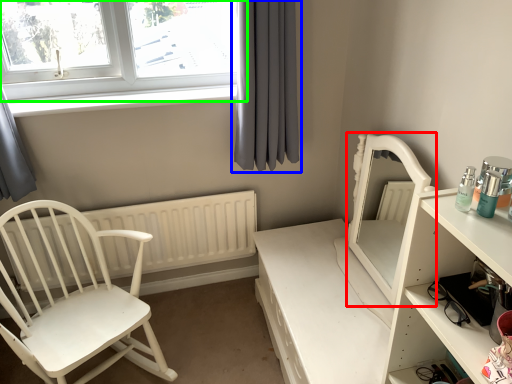
Question: Estimate the real-world distances between objects in this image. Which object is closer to back (highlighted by a red box), curtain (highlighted by a blue box) or window (highlighted by a green box)?

Choices:
 (A) curtain
 (B) window

Answer: (A)